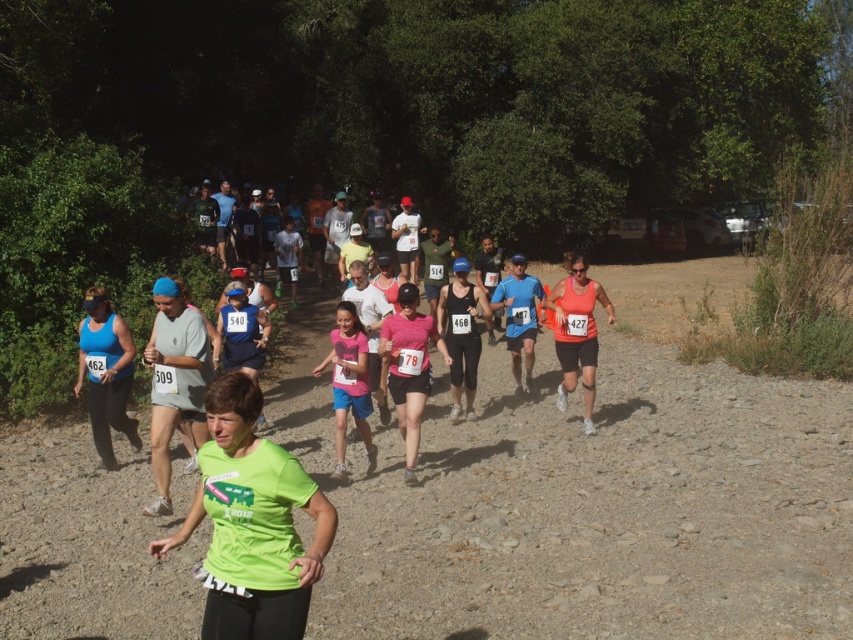
Is point (97, 380) positioned after point (595, 291)?

No, it is in front of (595, 291).

Which is above, matte blue tank top at left or orange matte tank top at center?

orange matte tank top at center

Does point (120, 392) come farther from viewer compared to point (584, 276)?

No, (120, 392) is in front of (584, 276).

Identify the location of matte blue tank top at left. click(x=105, y=372).

Is brown gravel path at center smaller than orange matte tank top at center?

No, brown gravel path at center is not smaller than orange matte tank top at center.

Can you confirm if brown gravel path at center is bigger than orange matte tank top at center?

Indeed, brown gravel path at center has a larger size compared to orange matte tank top at center.

Is point (316, 451) behind point (584, 324)?

Yes, it is behind point (584, 324).

In order to click on brown gravel path at center in this screenshot , I will do `click(589, 497)`.

Where is `brown gravel path at center`? brown gravel path at center is located at coordinates (589, 497).

Looking at this image, measure the distance between brown gravel path at center and camera.

The distance of brown gravel path at center from camera is 5.39 meters.

The height and width of the screenshot is (640, 853). I want to click on brown gravel path at center, so click(x=589, y=497).